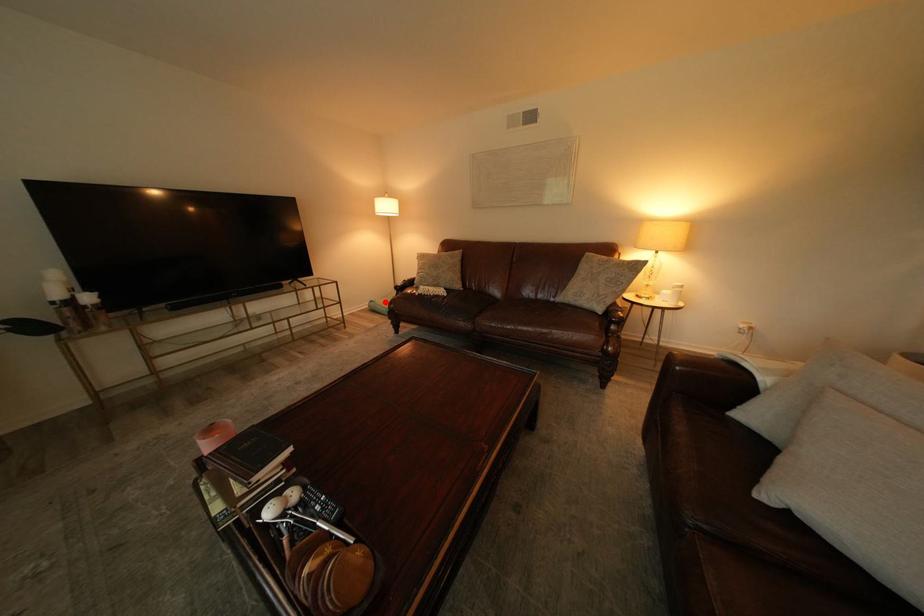
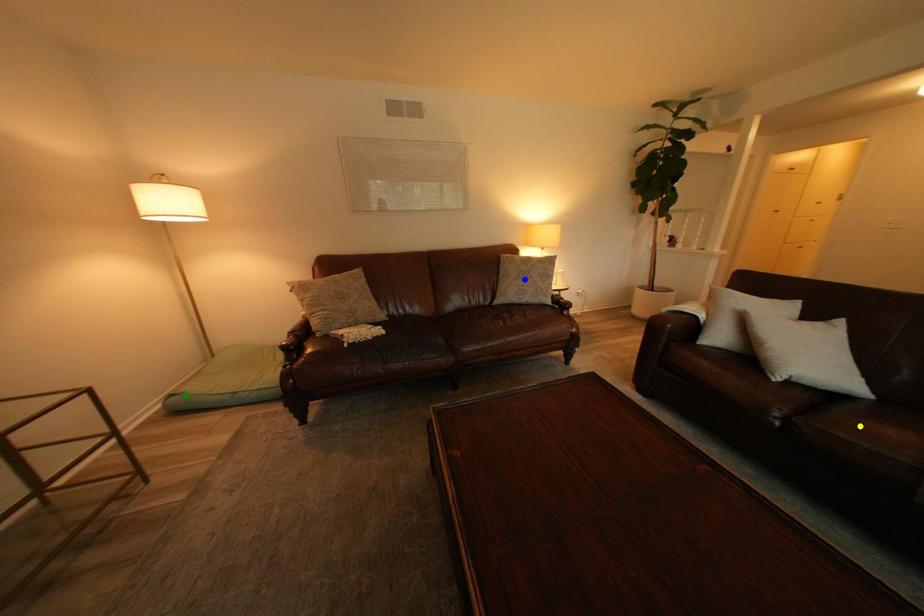
Question: I am providing you with two images of the same scene from different viewpoints. A red point is marked on the first image. You are given multiple points on the second image. Which mark in image 2 goes with the point in image 1?

Choices:
 (A) green point
 (B) yellow point
 (C) blue point

Answer: (A)